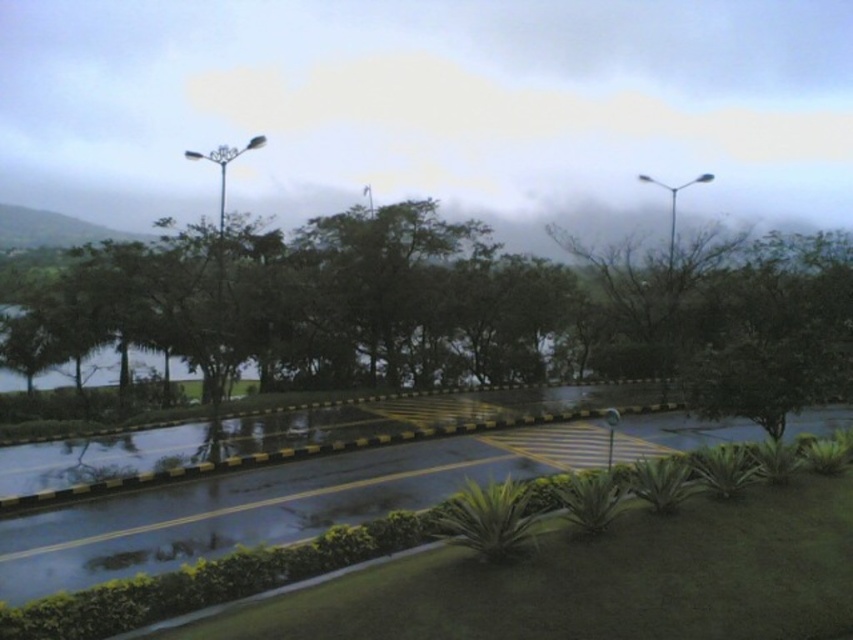
Does green leafy tree at center have a lesser width compared to wet asphalt road at lower center?

In fact, green leafy tree at center might be wider than wet asphalt road at lower center.

Can you confirm if green leafy tree at center is positioned to the right of wet asphalt road at lower center?

No, green leafy tree at center is not to the right of wet asphalt road at lower center.

The width and height of the screenshot is (853, 640). What do you see at coordinates (409, 305) in the screenshot?
I see `green leafy tree at center` at bounding box center [409, 305].

Find the location of a particular element. green leafy tree at center is located at coordinates (409, 305).